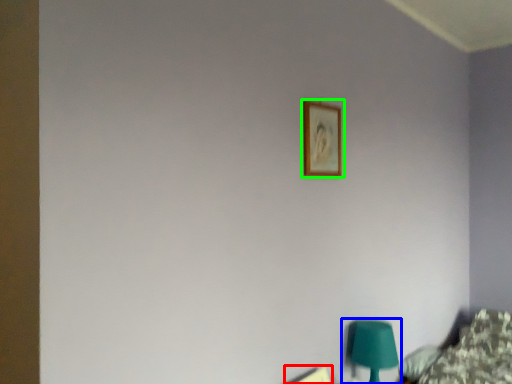
Question: Which object is the farthest from picture frame (highlighted by a red box)? Choose among these: table lamp (highlighted by a blue box) or picture frame (highlighted by a green box).

Choices:
 (A) table lamp
 (B) picture frame

Answer: (B)